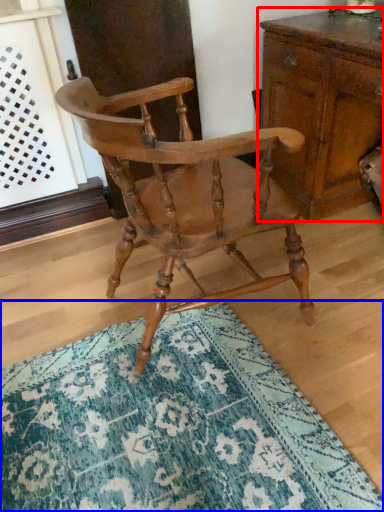
Question: Which point is further to the camera, chest of drawers (highlighted by a red box) or doormat (highlighted by a blue box)?

Choices:
 (A) chest of drawers
 (B) doormat

Answer: (A)